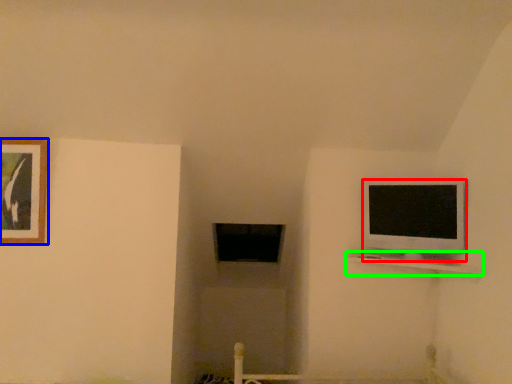
Question: Based on their relative distances, which object is nearer to television (highlighted by a red box)? Choose from picture frame (highlighted by a blue box) and shelf (highlighted by a green box).

Choices:
 (A) picture frame
 (B) shelf

Answer: (B)